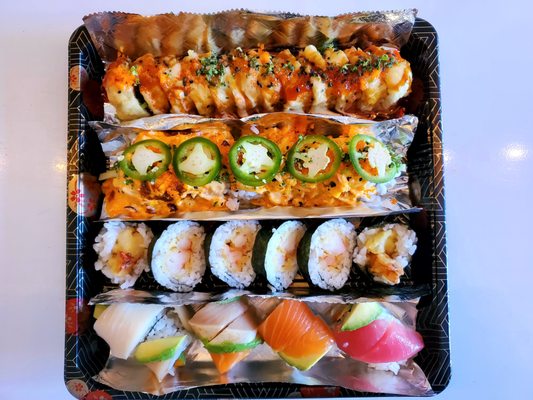
Where is `table`? table is located at coordinates (466, 214).